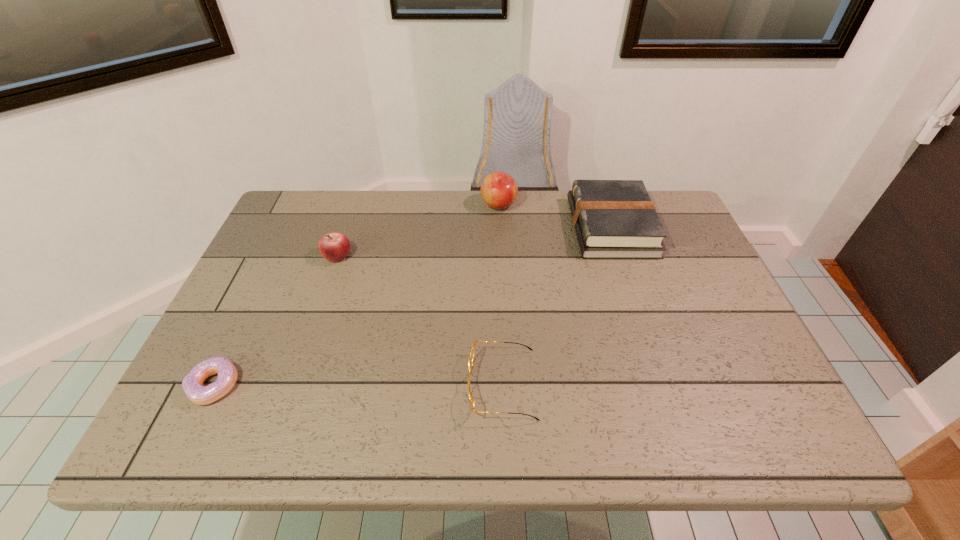
Where is `vacant space located on the spine side of the hardback book`? vacant space located on the spine side of the hardback book is located at coordinates (546, 227).

You are a GUI agent. You are given a task and a screenshot of the screen. Output one action in this format:
    pyautogui.click(x=<x>, y=<y>)
    Task: Click on the vacant space located on the spine side of the hardback book
    Image resolution: width=960 pixels, height=540 pixels.
    Given the screenshot: What is the action you would take?
    pyautogui.click(x=460, y=227)

Where is `vacant region located 0.250m on the back of the shorter apple`? This screenshot has width=960, height=540. vacant region located 0.250m on the back of the shorter apple is located at coordinates 357,195.

Where is `free region located on the front-facing side of the spectacles`? The height and width of the screenshot is (540, 960). free region located on the front-facing side of the spectacles is located at coordinates (421, 384).

The width and height of the screenshot is (960, 540). What are the coordinates of `vacant region located 0.180m on the front-facing side of the spectacles` in the screenshot? It's located at (384, 384).

I want to click on free space located on the front-facing side of the spectacles, so click(x=324, y=384).

Find the location of a particular element. The height and width of the screenshot is (540, 960). blank space located 0.400m on the back of the shortest object is located at coordinates (281, 247).

Locate an element on the screen. apple at the far edge is located at coordinates (499, 190).

Find the location of a particular element. hardback book present at the far edge is located at coordinates (614, 219).

Image resolution: width=960 pixels, height=540 pixels. Identify the location of spectacles at the near edge. (471, 357).